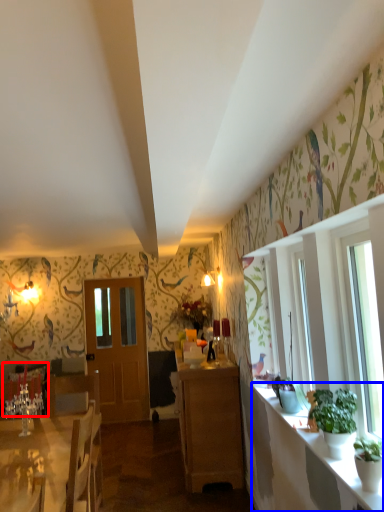
Question: Among these objects, which one is nearest to the camera, armchair (highlighted by a red box) or counter top (highlighted by a blue box)?

Choices:
 (A) armchair
 (B) counter top

Answer: (B)